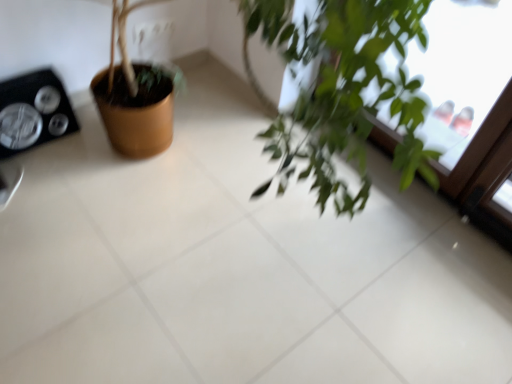
This screenshot has height=384, width=512. Describe the element at coordinates (33, 112) in the screenshot. I see `metallic silver speaker at upper left` at that location.

Locate an element on the screen. The height and width of the screenshot is (384, 512). metallic silver speaker at upper left is located at coordinates (33, 112).

I want to click on metallic silver speaker at upper left, so click(x=33, y=112).